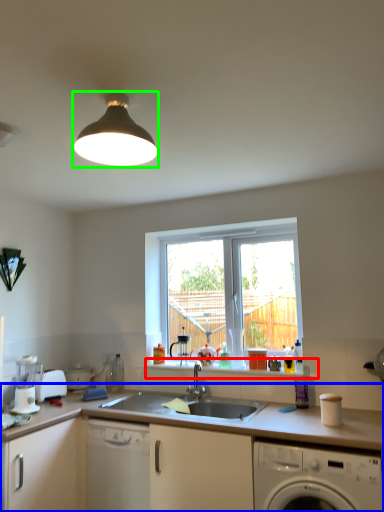
Question: Considering the real-world distances, which object is farthest from window sill (highlighted by a red box)? countertop (highlighted by a blue box) or light fixture (highlighted by a green box)?

Choices:
 (A) countertop
 (B) light fixture

Answer: (B)